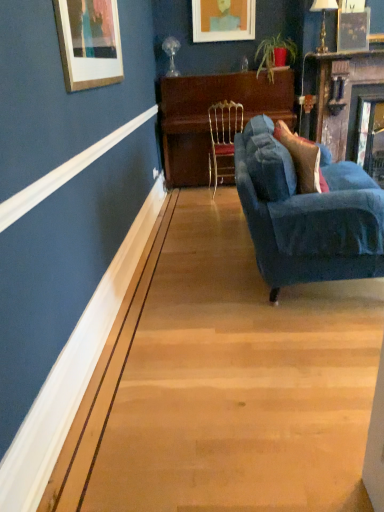
I want to click on free point below matte orange picture frame at upper center (from a real-world perspective), so click(x=217, y=71).